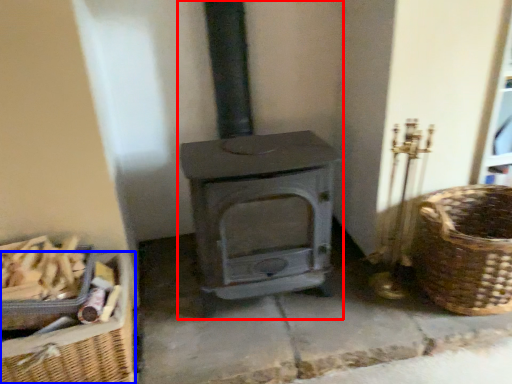
Question: Which object appears farthest to the camera in this image, wood burning stove (highlighted by a red box) or basket (highlighted by a blue box)?

Choices:
 (A) wood burning stove
 (B) basket

Answer: (B)